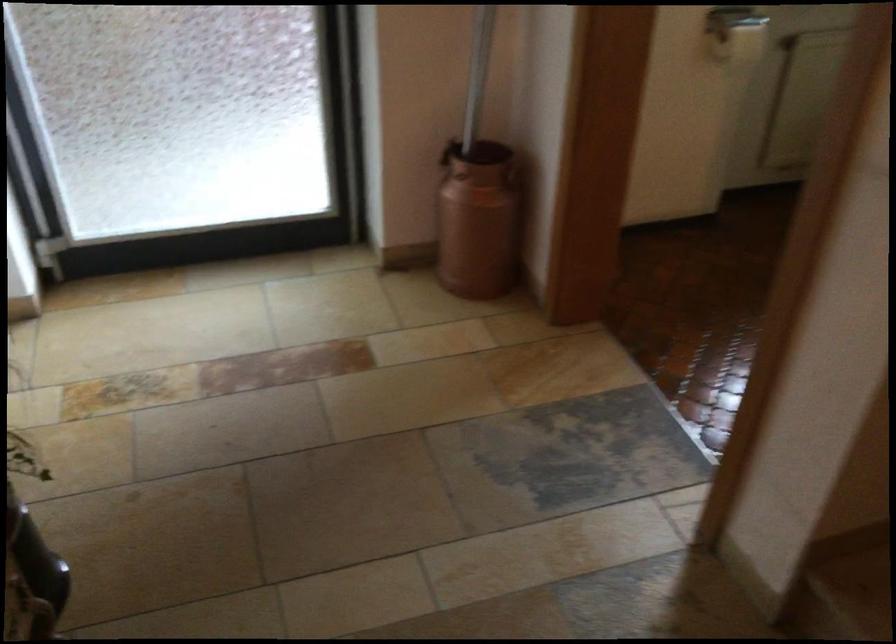
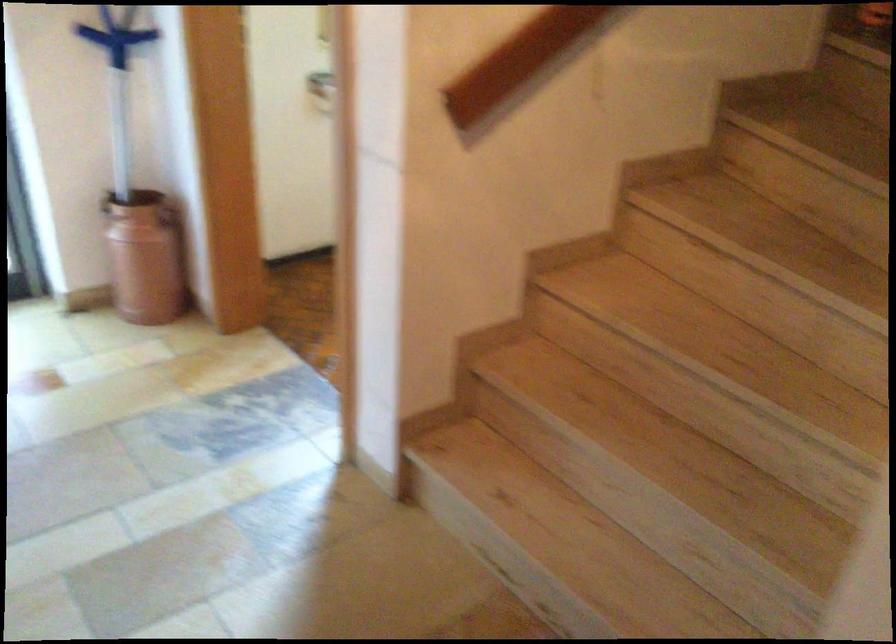
Question: How did the camera likely rotate?

Choices:
 (A) Left
 (B) Right
 (C) Up
 (D) Down

Answer: (B)